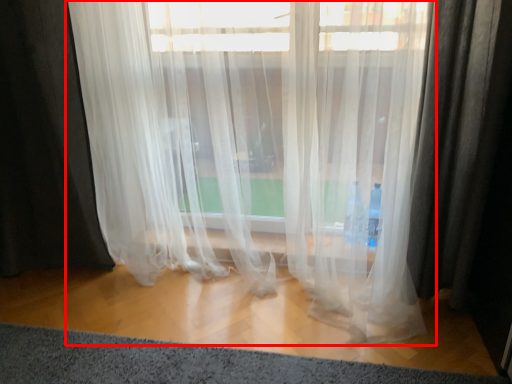
Question: From the image's perspective, where is curtain (annotated by the red box) located relative to doormat?

Choices:
 (A) above
 (B) below

Answer: (A)